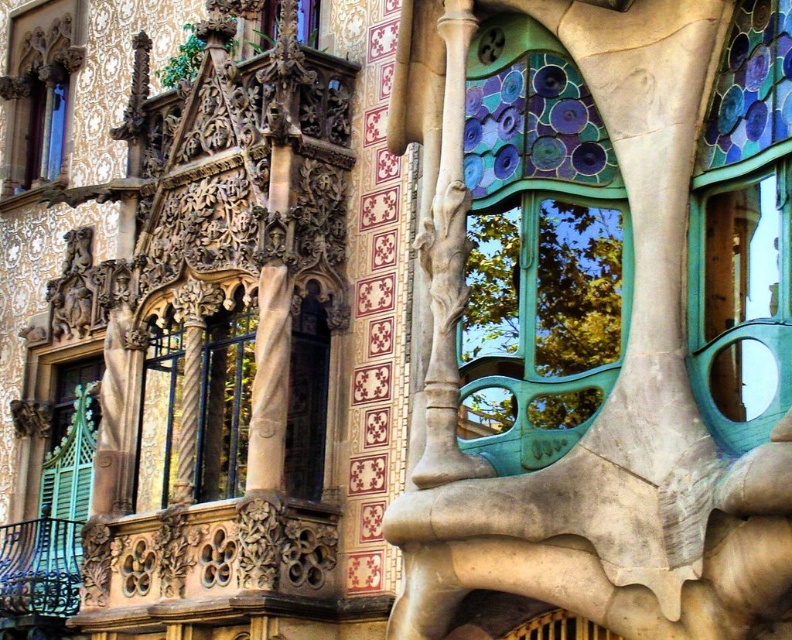
Based on the photo, you are an architect examining the facade of Casa Batll? and need to install a new light fixture. The teal glass window at center right and the matte glass window at upper left are both potential locations. Which window has a smaller width, making it suitable for a narrower light fixture?

The teal glass window at center right has a smaller width than the matte glass window at upper left, making it suitable for a narrower light fixture.

You are a tour guide explaining the architecture of Casa Batll? to visitors. You want to highlight the spatial relationship between the teal glass window at center right and the matte glass window at upper left. How far apart are these two windows?

The teal glass window at center right is 174.98 feet away from the matte glass window at upper left.

You are an architect analyzing the facade of Casa Batll? You observe the teal glass window at center right and the matte glass window at upper left. Which window takes up more area on the facade?

The matte glass window at upper left occupies more space than the teal glass window at center right, so the matte glass window at upper left takes up more area on the facade.